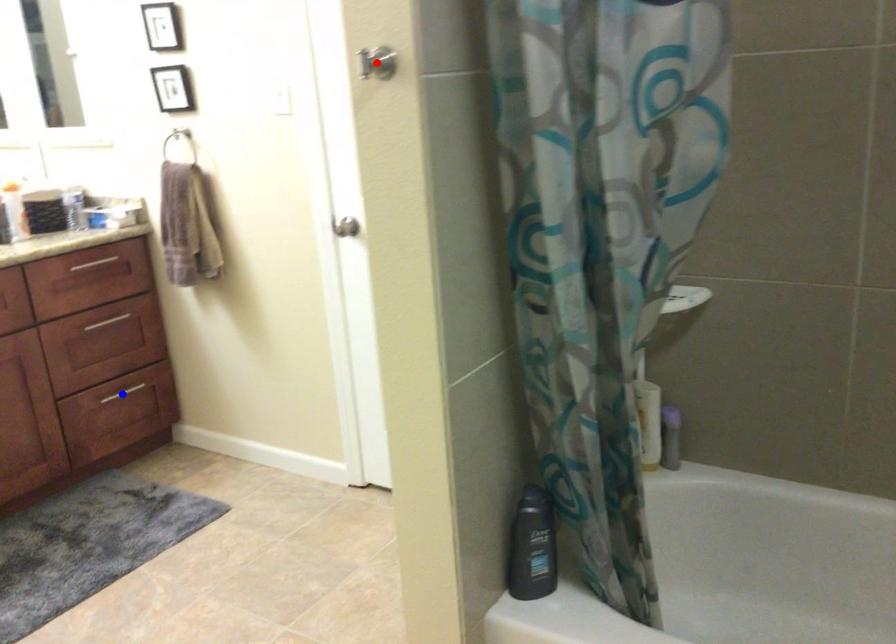
Question: Which of the two points in the image is closer to the camera?

Choices:
 (A) Blue point is closer.
 (B) Red point is closer.

Answer: (B)